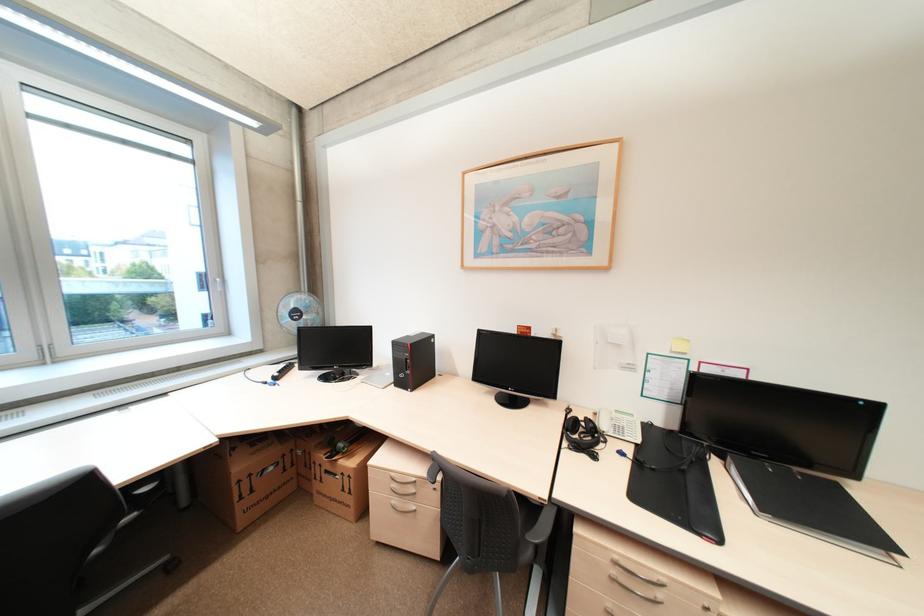
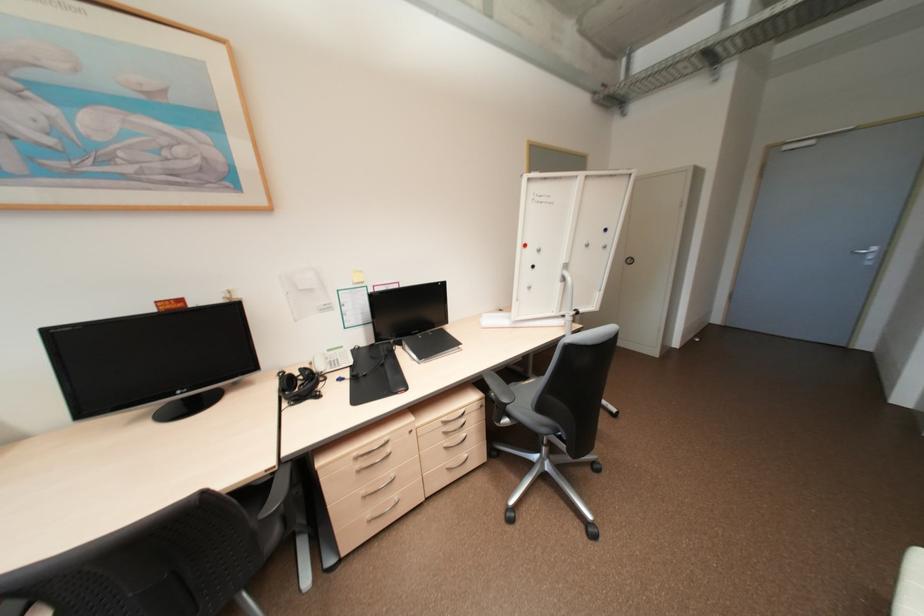
Question: The camera is either moving clockwise (left) or counter-clockwise (right) around the object. The first image is from the beginning of the video and the second image is from the end. Is the camera moving left or right when shooting the video?

Choices:
 (A) Left
 (B) Right

Answer: (A)